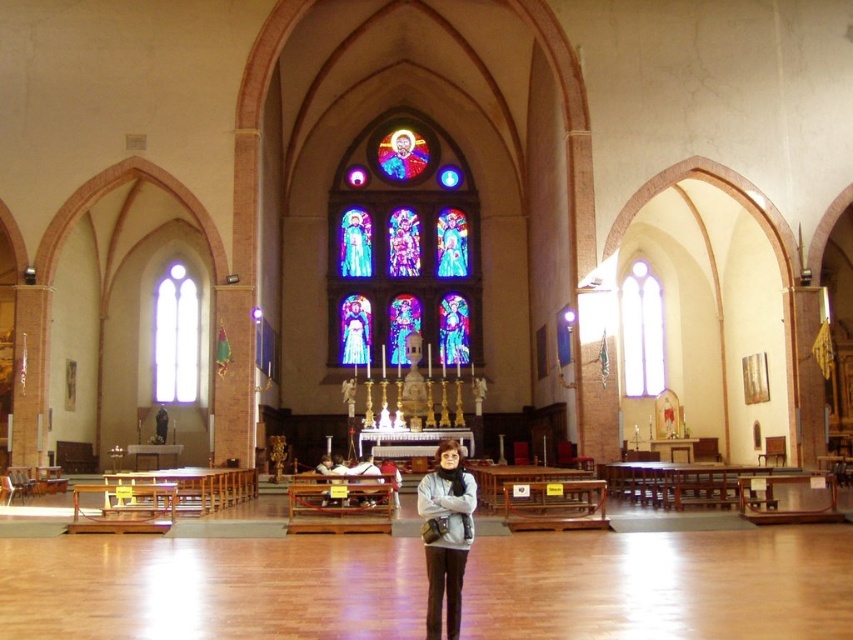
Question: Is gray matte sweater at center thinner than clear glass window at left?

Choices:
 (A) no
 (B) yes

Answer: (B)

Question: Among these points, which one is farthest from the camera?

Choices:
 (A) (334, 202)
 (B) (442, 474)
 (C) (659, 336)
 (D) (189, 380)

Answer: (A)

Question: Is stained glass window at center to the left of clear glass window at right from the viewer's perspective?

Choices:
 (A) yes
 (B) no

Answer: (A)

Question: Observing the image, what is the correct spatial positioning of stained glass window at center in reference to gray matte sweater at center?

Choices:
 (A) right
 (B) left

Answer: (B)

Question: Which point appears farthest from the camera in this image?

Choices:
 (A) (194, 374)
 (B) (469, 534)
 (C) (366, 312)
 (D) (660, 310)

Answer: (C)

Question: Among these objects, which one is farthest from the camera?

Choices:
 (A) gray matte sweater at center
 (B) clear glass window at left
 (C) clear glass window at right

Answer: (C)